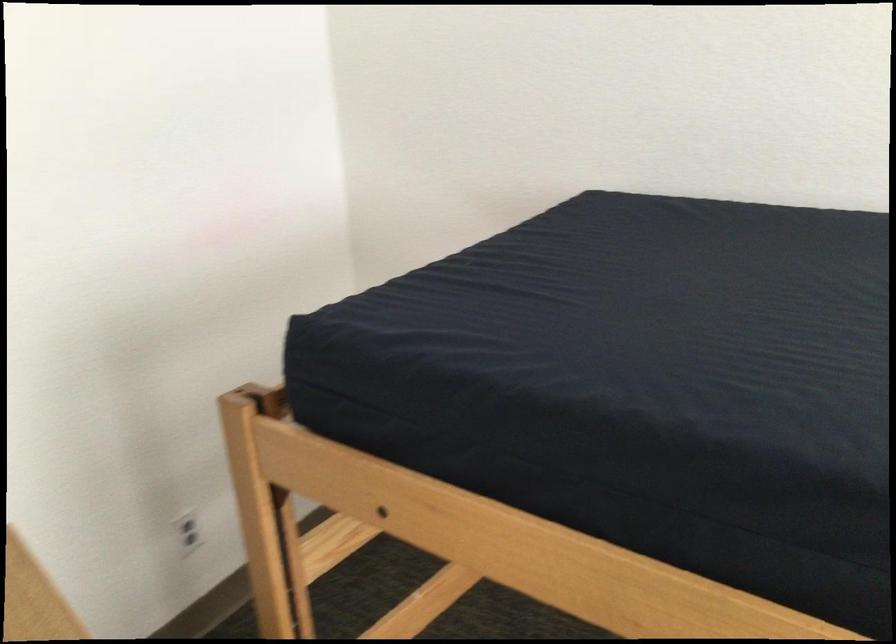
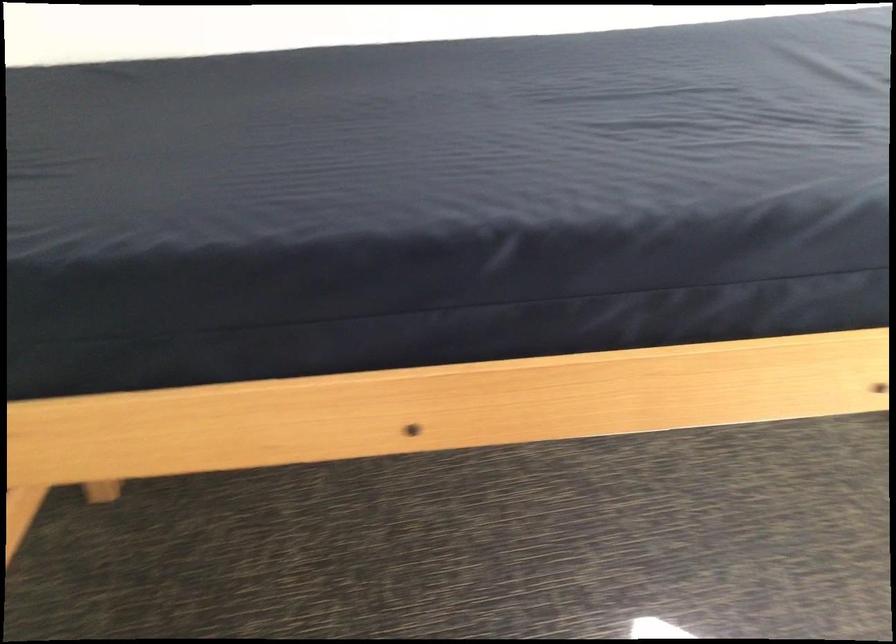
Locate, in the second image, the point that corresponds to point 651,477 in the first image.

(254, 308)